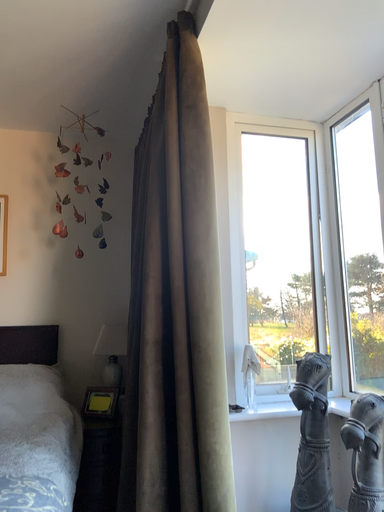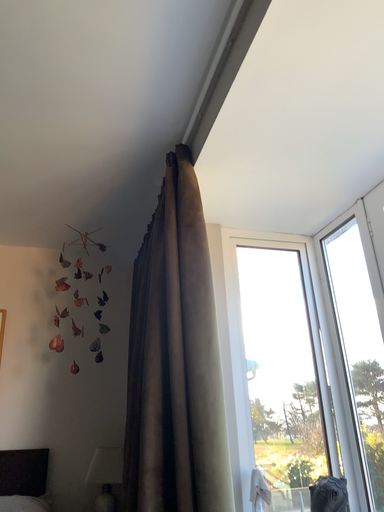
Question: How did the camera likely rotate when shooting the video?

Choices:
 (A) rotated upward
 (B) rotated downward

Answer: (A)